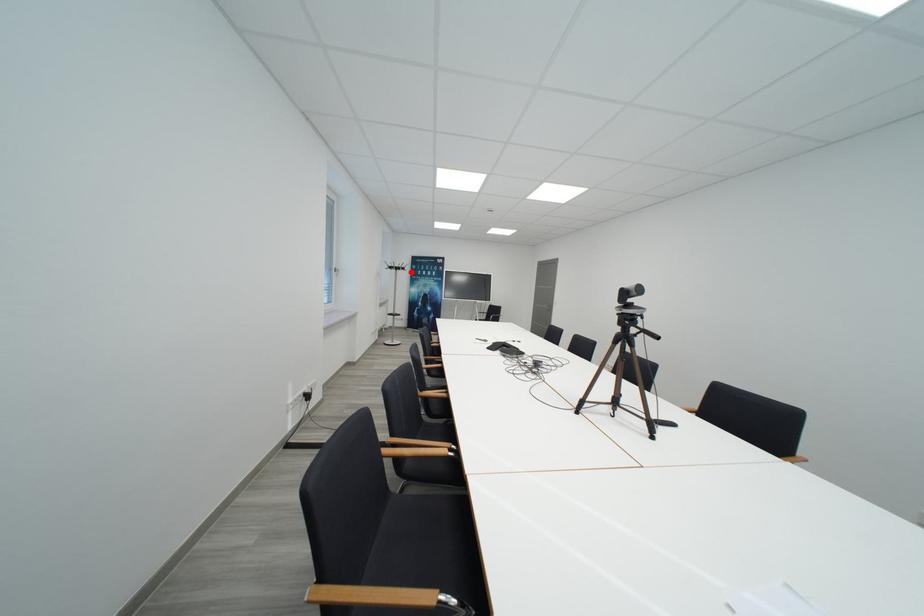
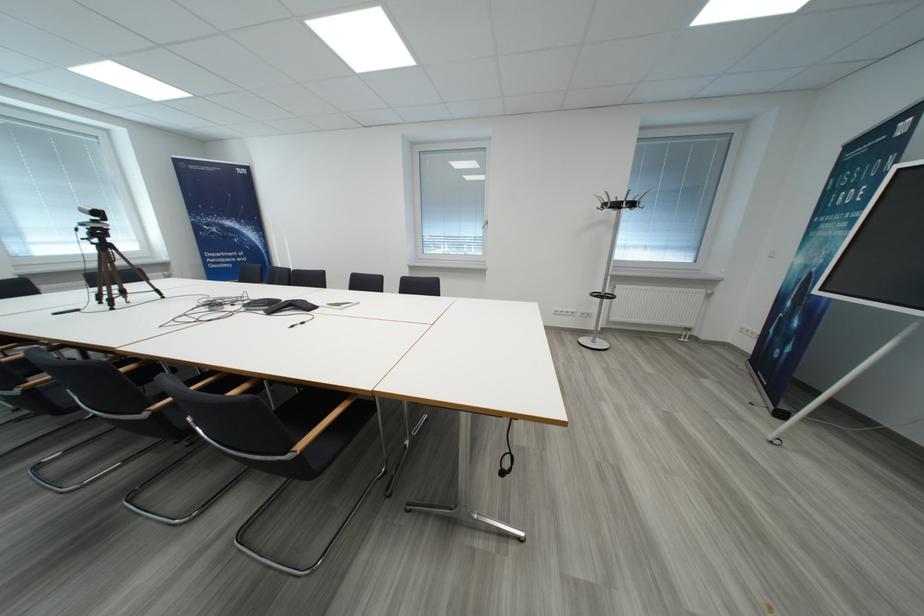
Find the pixel in the second image that matches the highlighted location in the first image.

(623, 208)